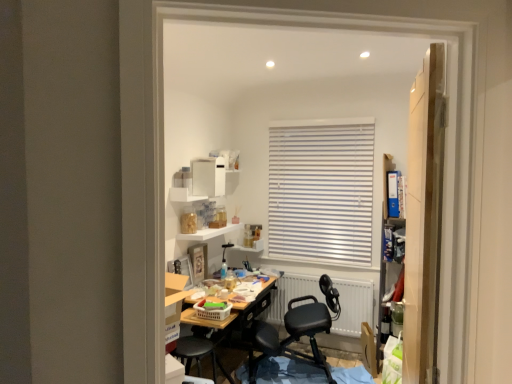
Question: Is black leather office chair at center in front of or behind white glossy shelf at upper center, acting as the second shelf starting from the bottom, in the image?

Choices:
 (A) behind
 (B) front

Answer: (B)

Question: Considering the positions of black leather office chair at center and white glossy shelf at upper center, the first shelf positioned from the top, in the image, is black leather office chair at center taller or shorter than white glossy shelf at upper center, the first shelf positioned from the top,?

Choices:
 (A) short
 (B) tall

Answer: (B)

Question: Which of these objects is positioned farthest from the white glossy shelf at upper center, acting as the second shelf starting from the bottom?

Choices:
 (A) white matte radiator at center
 (B) black leather office chair at center
 (C) white matte shelf at upper center, which is counted as the 2th shelf, starting from the top
 (D) wooden door at right
 (E) plastic laundry basket at center

Answer: (D)

Question: Which of these objects is positioned closest to the white glossy shelf at upper center, the first shelf positioned from the top?

Choices:
 (A) black leather office chair at center
 (B) plastic laundry basket at center
 (C) wooden door at right
 (D) white matte shelf at upper center, which is counted as the 2th shelf, starting from the top
 (E) white matte radiator at center

Answer: (D)